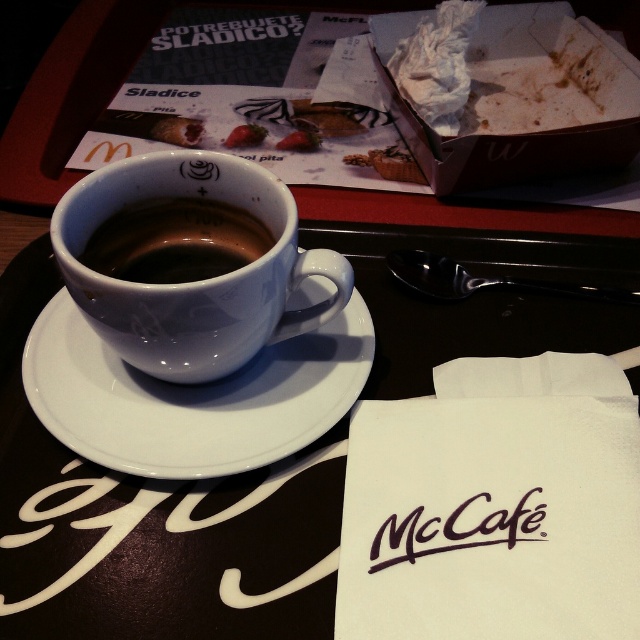
Question: Does white glossy mug at upper center have a larger size compared to smooth strawberry at center?

Choices:
 (A) no
 (B) yes

Answer: (B)

Question: Among these points, which one is farthest from the camera?

Choices:
 (A) (506, 547)
 (B) (264, 244)
 (C) (227, 145)
 (D) (289, 228)

Answer: (C)

Question: Which point is closer to the camera taking this photo?

Choices:
 (A) (385, 522)
 (B) (248, 250)
 (C) (272, 388)

Answer: (A)

Question: Does white glossy mug at upper center have a lesser width compared to black paper napkin at lower center?

Choices:
 (A) yes
 (B) no

Answer: (B)

Question: Which object is farther from the camera taking this photo?

Choices:
 (A) smooth strawberry at center
 (B) matte ceramic cup at center
 (C) white glossy mug at upper center
 (D) white ceramic saucer at center

Answer: (A)

Question: Does white glossy mug at upper center have a lesser width compared to black paper napkin at lower center?

Choices:
 (A) yes
 (B) no

Answer: (B)